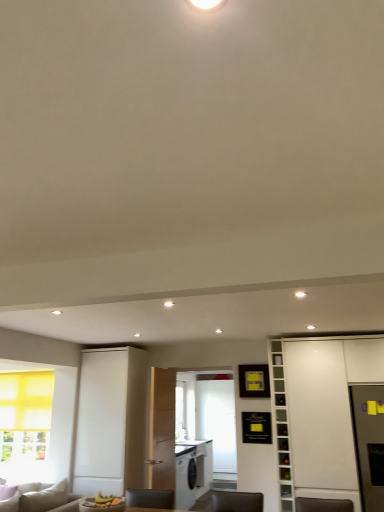
I want to click on white matte cabinet at right, so click(x=320, y=411).

This screenshot has width=384, height=512. What do you see at coordinates (320, 411) in the screenshot?
I see `white matte cabinet at right` at bounding box center [320, 411].

Find the location of a particular element. This screenshot has height=512, width=384. white glossy bookshelf at right is located at coordinates tap(281, 424).

What do you see at coordinates (281, 424) in the screenshot? I see `white glossy bookshelf at right` at bounding box center [281, 424].

Identify the location of white matte cabinet at right. (320, 411).

Between white glossy bookshelf at right and white matte cabinet at right, which one appears on the left side from the viewer's perspective?

white glossy bookshelf at right is more to the left.

Is white glossy bookshelf at right in front of or behind white matte cabinet at right in the image?

Clearly, white glossy bookshelf at right is behind white matte cabinet at right.

Considering the positions of points (283, 380) and (326, 436), is point (283, 380) farther from camera compared to point (326, 436)?

Yes, it is.

From the image's perspective, relative to white matte cabinet at right, is white glossy bookshelf at right above or below?

Clearly, from the image's perspective, white glossy bookshelf at right is below white matte cabinet at right.

From a real-world perspective, who is located lower, white glossy bookshelf at right or white matte cabinet at right?

white matte cabinet at right.

Considering the sizes of objects white glossy bookshelf at right and white matte cabinet at right in the image provided, who is wider, white glossy bookshelf at right or white matte cabinet at right?

white matte cabinet at right.

Which of these two, white glossy bookshelf at right or white matte cabinet at right, stands taller?

white matte cabinet at right is taller.

Is white glossy bookshelf at right bigger than white matte cabinet at right?

Incorrect, white glossy bookshelf at right is not larger than white matte cabinet at right.

Which is correct: white glossy bookshelf at right is inside white matte cabinet at right, or outside of it?

white glossy bookshelf at right is located beyond the bounds of white matte cabinet at right.

Is white glossy bookshelf at right not near white matte cabinet at right?

white glossy bookshelf at right is near white matte cabinet at right, not far away.

Is white glossy bookshelf at right turned away from white matte cabinet at right?

That's not correct — white glossy bookshelf at right is not looking away from white matte cabinet at right.

How different are the orientations of white glossy bookshelf at right and white matte cabinet at right in degrees?

The facing directions of white glossy bookshelf at right and white matte cabinet at right are 0.452 degrees apart.

Measure the distance between white glossy bookshelf at right and white matte cabinet at right.

A distance of 27.51 centimeters exists between white glossy bookshelf at right and white matte cabinet at right.

In the image, there is a white glossy bookshelf at right. Identify the location of cabinetry below it (from a real-world perspective). tap(320, 411).

Visually, is white matte cabinet at right positioned to the left or to the right of white glossy bookshelf at right?

white matte cabinet at right is to the right of white glossy bookshelf at right.

Does white matte cabinet at right lie behind white glossy bookshelf at right?

No, the depth of white matte cabinet at right is less than that of white glossy bookshelf at right.

In the scene shown: Which point is more forward, [305,392] or [280,389]?

The point [305,392] is closer.

From the image's perspective, relative to white glossy bookshelf at right, is white matte cabinet at right above or below?

white matte cabinet at right is situated higher than white glossy bookshelf at right in the image.

From a real-world perspective, relative to white glossy bookshelf at right, is white matte cabinet at right vertically above or below?

Clearly, from a real-world perspective, white matte cabinet at right is below white glossy bookshelf at right.

Considering the relative sizes of white matte cabinet at right and white glossy bookshelf at right in the image provided, is white matte cabinet at right wider than white glossy bookshelf at right?

Correct, the width of white matte cabinet at right exceeds that of white glossy bookshelf at right.

Between white matte cabinet at right and white glossy bookshelf at right, which one has more height?

white matte cabinet at right is taller.

In the scene shown: Considering the sizes of objects white matte cabinet at right and white glossy bookshelf at right in the image provided, who is smaller, white matte cabinet at right or white glossy bookshelf at right?

With smaller size is white glossy bookshelf at right.

Is white matte cabinet at right not inside white glossy bookshelf at right?

Yes, white matte cabinet at right is located beyond the bounds of white glossy bookshelf at right.

Is white matte cabinet at right directly adjacent to white glossy bookshelf at right?

No, white matte cabinet at right is not next to white glossy bookshelf at right.

Is white matte cabinet at right turned away from white glossy bookshelf at right?

No, white matte cabinet at right is not facing the opposite direction of white glossy bookshelf at right.

Measure the distance from white matte cabinet at right to white glossy bookshelf at right.

They are 10.83 inches apart.

Identify the location of bookshelf above the white matte cabinet at right (from a real-world perspective). (281, 424).

Locate an element on the screen. bookshelf that appears behind the white matte cabinet at right is located at coordinates (281, 424).

There is a white matte cabinet at right. Where is `bookshelf above it (from a real-world perspective)`? bookshelf above it (from a real-world perspective) is located at coordinates (281, 424).